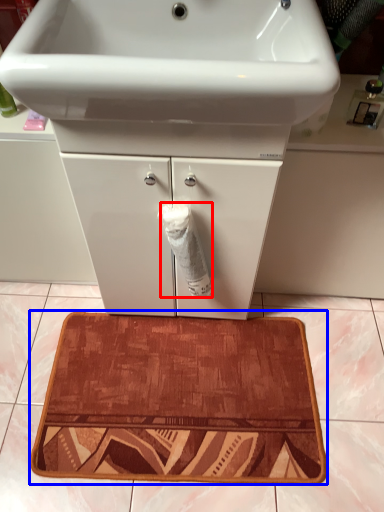
Question: Which of the following is the farthest to the observer, toilet paper (highlighted by a red box) or bath mat (highlighted by a blue box)?

Choices:
 (A) toilet paper
 (B) bath mat

Answer: (B)